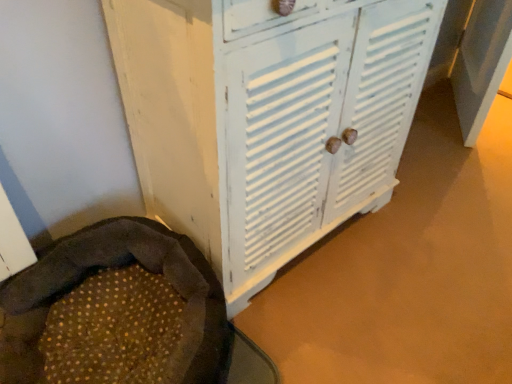
Question: From a real-world perspective, is white painted wood cupboard at center physically above brown textured fabric bean bag chair at lower left?

Choices:
 (A) no
 (B) yes

Answer: (B)

Question: Can you confirm if white painted wood cupboard at center is thinner than brown textured fabric bean bag chair at lower left?

Choices:
 (A) yes
 (B) no

Answer: (A)

Question: Does white painted wood cupboard at center appear on the right side of brown textured fabric bean bag chair at lower left?

Choices:
 (A) no
 (B) yes

Answer: (B)

Question: Is white painted wood cupboard at center in front of brown textured fabric bean bag chair at lower left?

Choices:
 (A) no
 (B) yes

Answer: (B)

Question: Is white painted wood cupboard at center wider than brown textured fabric bean bag chair at lower left?

Choices:
 (A) yes
 (B) no

Answer: (B)

Question: From the image's perspective, is white painted wood cupboard at center on top of brown textured fabric bean bag chair at lower left?

Choices:
 (A) no
 (B) yes

Answer: (B)

Question: Can you confirm if brown textured fabric bean bag chair at lower left is wider than white painted wood cupboard at center?

Choices:
 (A) yes
 (B) no

Answer: (A)

Question: Considering the relative positions of brown textured fabric bean bag chair at lower left and white painted wood cupboard at center in the image provided, is brown textured fabric bean bag chair at lower left to the right of white painted wood cupboard at center from the viewer's perspective?

Choices:
 (A) no
 (B) yes

Answer: (A)

Question: Is brown textured fabric bean bag chair at lower left surrounding white painted wood cupboard at center?

Choices:
 (A) no
 (B) yes

Answer: (A)

Question: From the image's perspective, is brown textured fabric bean bag chair at lower left beneath white painted wood cupboard at center?

Choices:
 (A) yes
 (B) no

Answer: (A)

Question: Is brown textured fabric bean bag chair at lower left completely or partially outside of white painted wood cupboard at center?

Choices:
 (A) yes
 (B) no

Answer: (A)

Question: Considering the relative positions of brown textured fabric bean bag chair at lower left and white painted wood cupboard at center in the image provided, is brown textured fabric bean bag chair at lower left in front of white painted wood cupboard at center?

Choices:
 (A) yes
 (B) no

Answer: (B)

Question: Is white painted wood cupboard at center taller or shorter than brown textured fabric bean bag chair at lower left?

Choices:
 (A) tall
 (B) short

Answer: (A)